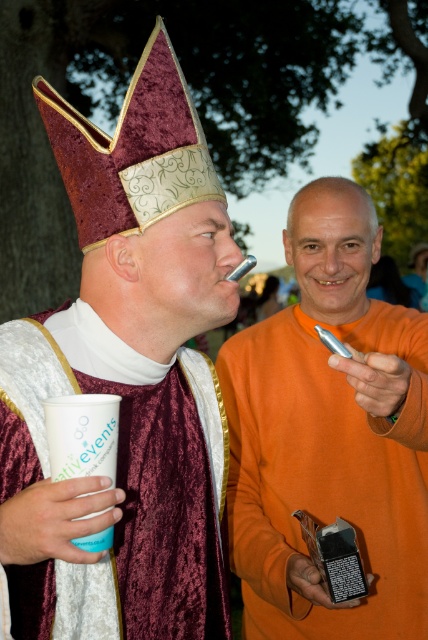
Consider the image. Who is positioned more to the left, orange matte shirt at center or velvet maroon robe at center?

Positioned to the left is velvet maroon robe at center.

The height and width of the screenshot is (640, 428). Describe the element at coordinates (329, 435) in the screenshot. I see `orange matte shirt at center` at that location.

This screenshot has width=428, height=640. What do you see at coordinates (329, 435) in the screenshot?
I see `orange matte shirt at center` at bounding box center [329, 435].

The image size is (428, 640). In order to click on orange matte shirt at center in this screenshot , I will do `click(329, 435)`.